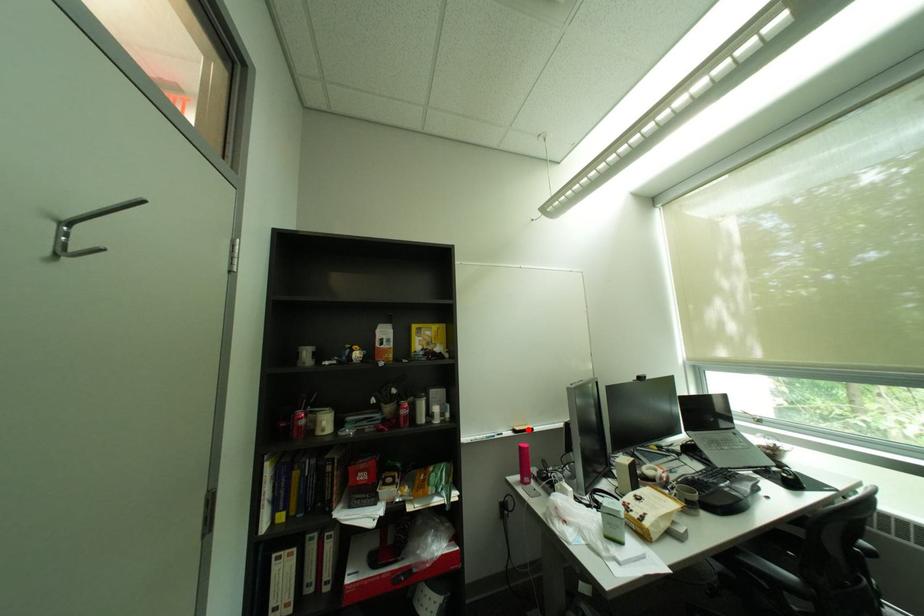
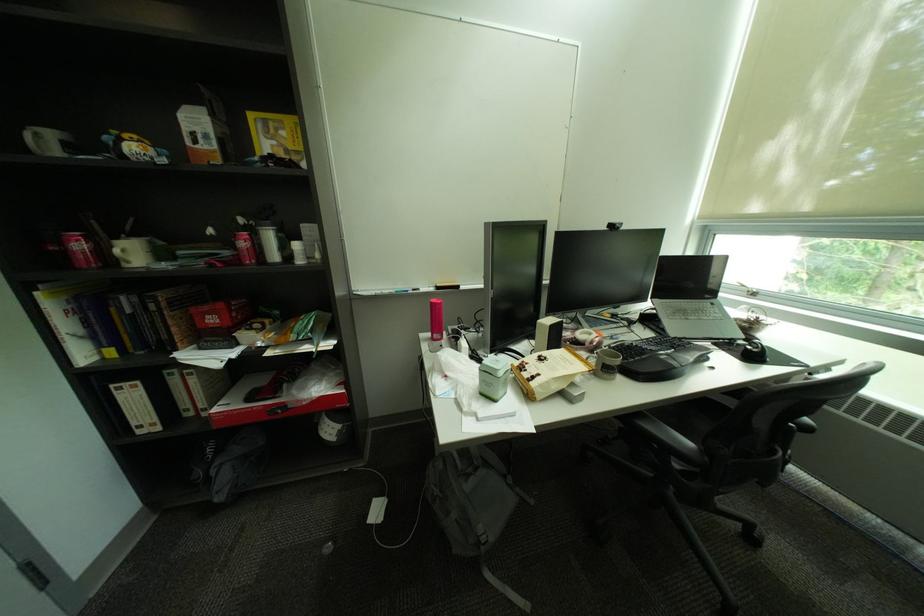
The point at the highlighted location is marked in the first image. Where is the corresponding point in the second image?

(450, 286)